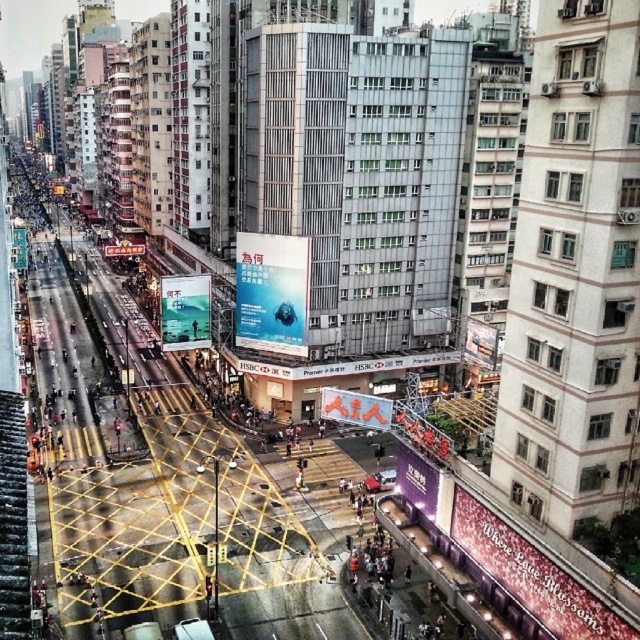
Question: Which is farther from the matte blue poster at center?

Choices:
 (A) matte white billboard at center
 (B) purple glossy billboard at lower center
 (C) blue glossy poster at center
 (D) matte red sign at center

Answer: (A)

Question: Which of the following is the closest to the observer?

Choices:
 (A) (104, 253)
 (B) (397, 472)

Answer: (B)

Question: Does matte pink billboard at lower right have a lesser width compared to matte red sign at center?

Choices:
 (A) yes
 (B) no

Answer: (B)

Question: Which object is farther from the camera taking this photo?

Choices:
 (A) purple glossy billboard at lower center
 (B) matte pink billboard at lower right

Answer: (A)

Question: Is blue glossy poster at center to the right of matte white billboard at center from the viewer's perspective?

Choices:
 (A) no
 (B) yes

Answer: (B)

Question: Is matte pink billboard at lower right behind blue glossy poster at center?

Choices:
 (A) yes
 (B) no

Answer: (B)